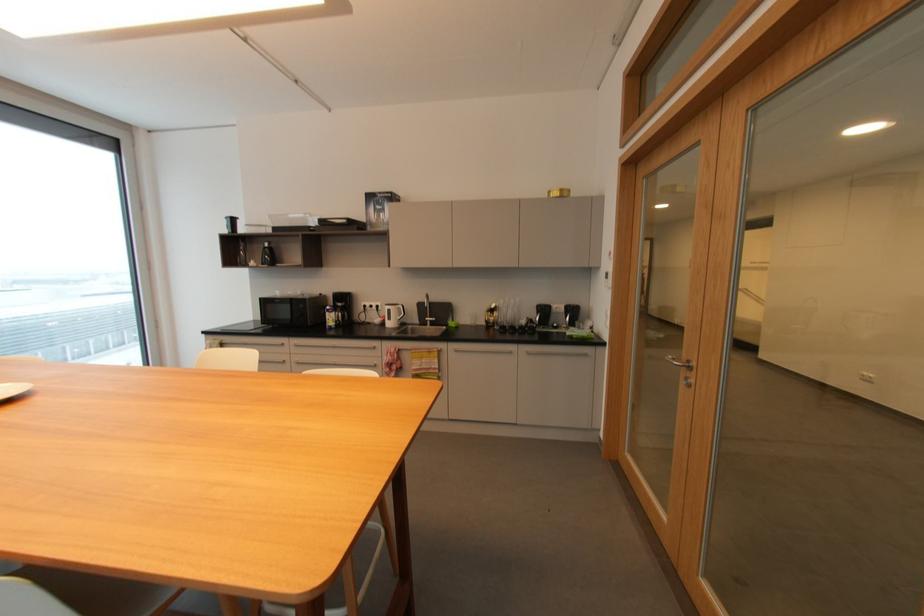
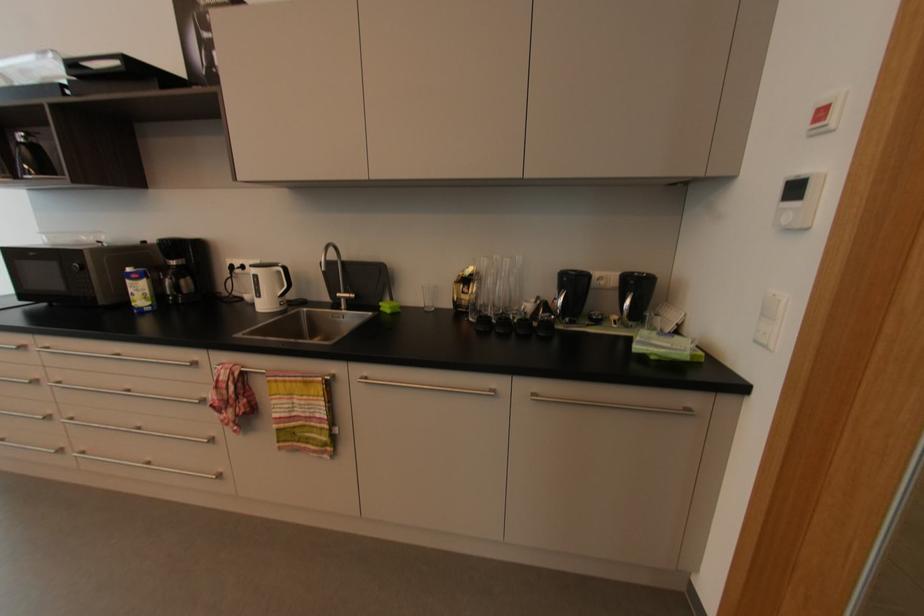
The point at (540, 326) is marked in the first image. Where is the corresponding point in the second image?

(561, 317)